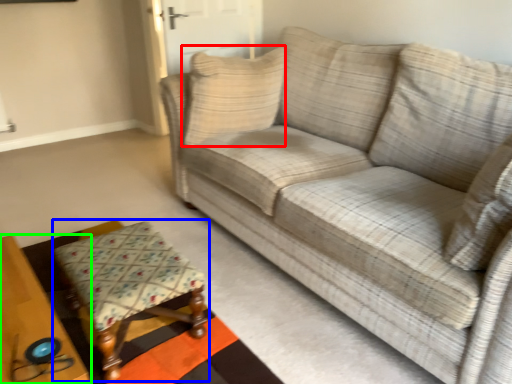
Question: Considering the real-world distances, which object is farthest from pillow (highlighted by a red box)? stool (highlighted by a blue box) or table (highlighted by a green box)?

Choices:
 (A) stool
 (B) table

Answer: (B)